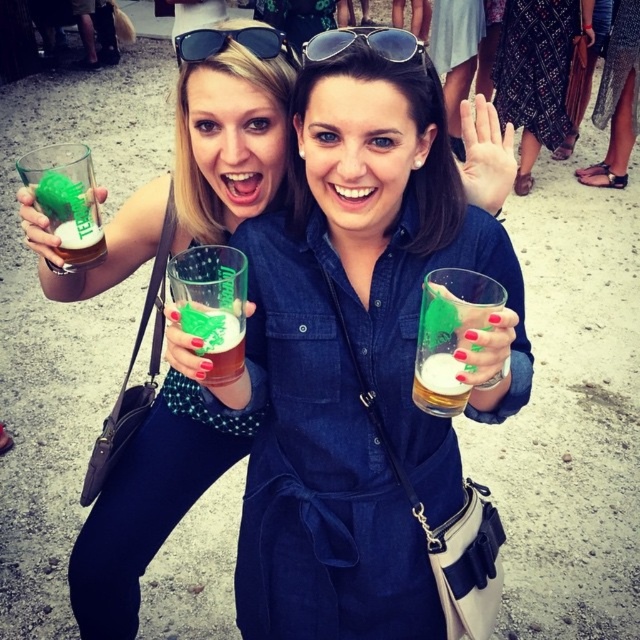
You are a photographer at a social event. You want to take a photo of both the matte denim dress at center and the printed fabric dress at center. Which dress should you focus on first to ensure both are in frame?

You should focus on the matte denim dress at center first because it is closer to the viewer, so adjusting the camera to include it will also capture the printed fabric dress at center which is further back.

From the picture: You are standing at the origin point of the coordinate system in the image. The woman wearing the satin black dress at lower right is located at point 0.156, 0.966. If you want to walk towards her, in which direction should you move?

The satin black dress at lower right is located at coordinate point [618,99]. Since you are at the origin, you should move towards the positive x and y directions to reach her.